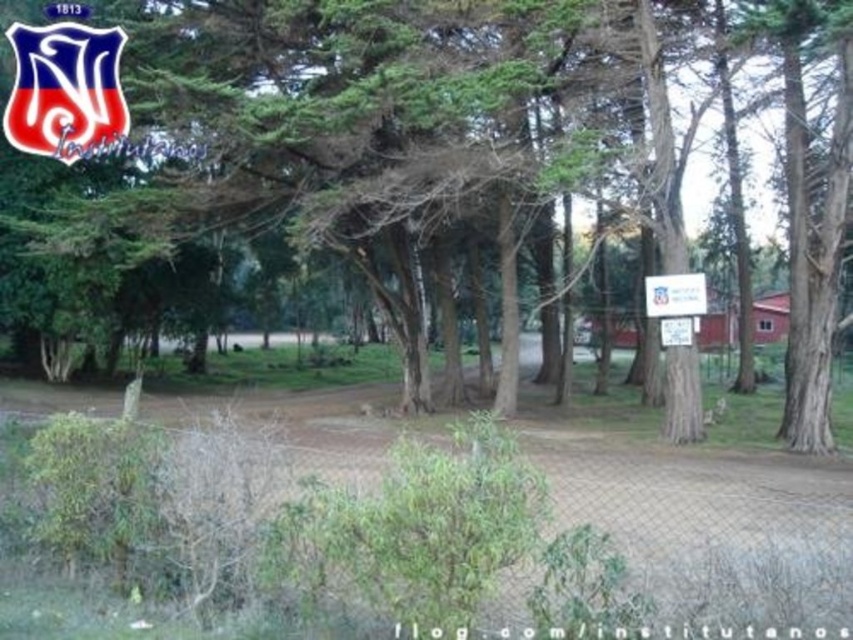
You are a hiker walking along the dirt path in the park. You see a green textured tree at center and a white plastic sign at center. Which object is higher up from the ground?

The green textured tree at center is located above the white plastic sign at center, so the green textured tree at center is higher up from the ground.

You are a hiker who just entered the park and are looking for the trailhead. You notice two markers ahead of you. The first is the matte plastic logo at upper left, and the second is the white plastic sign at center. Which marker is bigger?

The matte plastic logo at upper left is larger in size than the white plastic sign at center.

Looking at this image, you are a hiker carrying a backpack and need to place your backpack on the ground between the green textured tree at center and the white plastic sign at center. Is there enough space for the backpack if it requires 1 meter between the tree and the sign?

The distance between the green textured tree at center and the white plastic sign at center is 7.89 meters, which is more than enough space for the backpack requiring 1 meter between them.